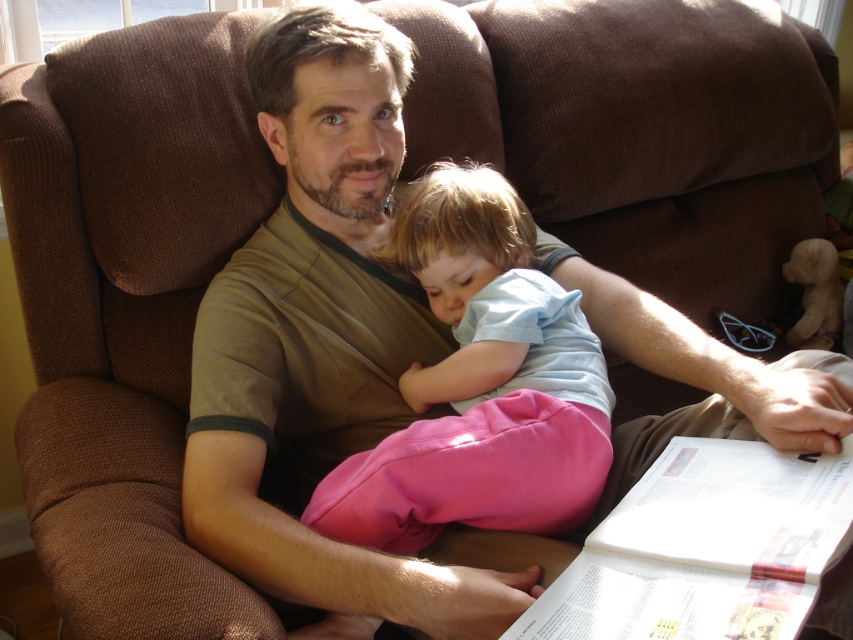
Does point (368, 506) come closer to viewer compared to point (654, 492)?

That is True.

Does point (447, 180) come behind point (720, 556)?

Yes, point (447, 180) is farther from viewer.

Which is behind, point (463, 426) or point (515, 636)?

The point (463, 426) is behind.

Identify the location of pink cotton pants at center. Image resolution: width=853 pixels, height=640 pixels. (480, 385).